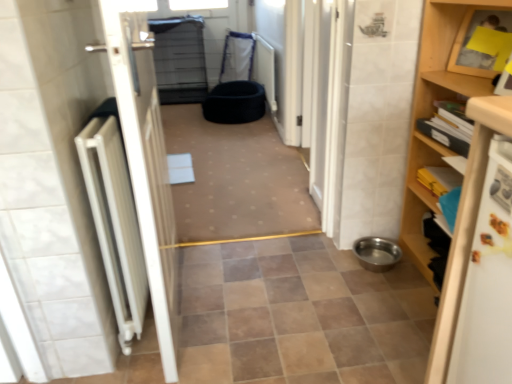
Find the location of a particular element. This screenshot has width=512, height=384. free space between white matte door at left and metallic stainless steel bowl at lower right, arranged as the 2th toilet bowl when viewed from the top is located at coordinates (272, 295).